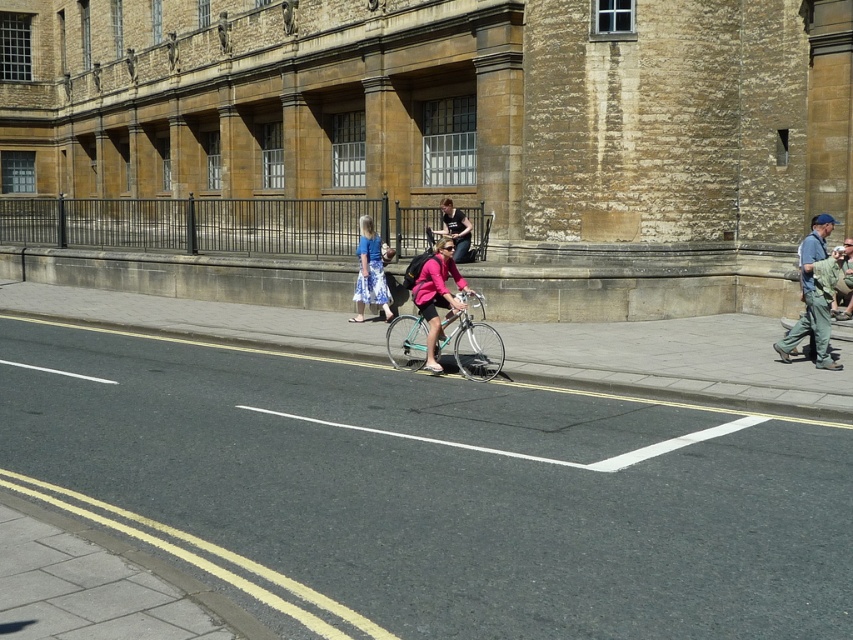
You are a delivery driver who needs to park your truck between the teal metallic bicycle at center and the matte pink jacket at center. The truck is 2 meters wide. Can you fit your truck between them?

The teal metallic bicycle at center might be wider than matte pink jacket at center, so the distance between them may be sufficient to accommodate the 2 meter wide truck. However, since the exact width difference is not specified, it is uncertain whether there is enough space.

You are a delivery person riding a bike with a 1.2 meter long package strapped to your bike. You are approaching the black asphalt bike lane at center and need to pass the matte pink shirt at center. Is there enough space between them to safely maneuver your bike and the package?

The distance between the black asphalt bike lane at center and the matte pink shirt at center is 8.65 meters. Since the package is only 1.2 meters long, there is sufficient space to safely maneuver around the matte pink shirt at center while staying within the black asphalt bike lane at center.

You are a delivery driver who needs to park your van temporarily. The van is 5 meters long. You see the black asphalt bike lane at center. Can you park your van entirely within the bike lane without blocking it?

The distance between the black asphalt bike lane at center and the camera is 4.48 meters. Since the van is 5 meters long, it cannot be parked entirely within the bike lane as the available space is shorter than the van.